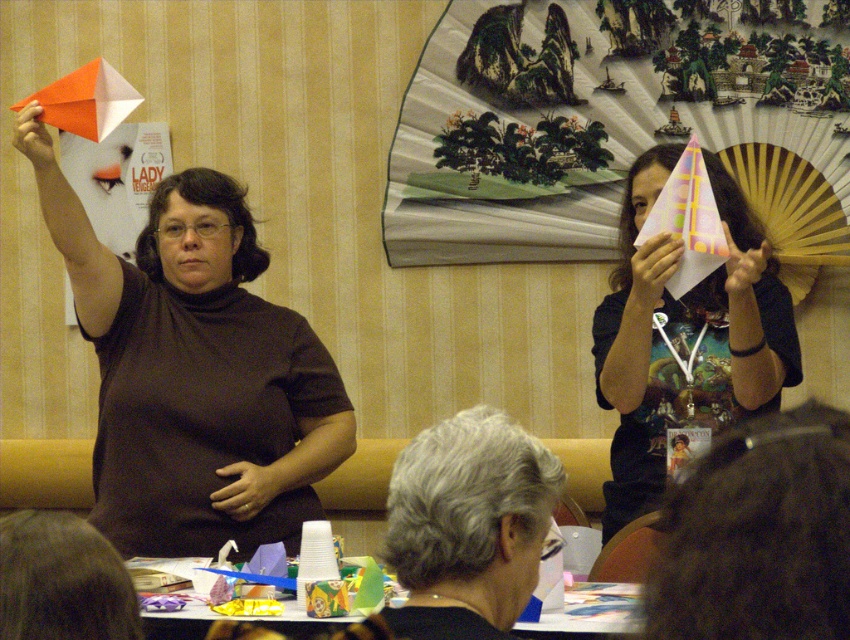
You are an observer in the room. You see the matte pink paper fan at upper right and the gray hair at upper center. Which object is positioned more to the right side of the scene?

The matte pink paper fan at upper right is positioned to the right of gray hair at upper center, so it is more to the right side of the scene.

You are a photographer trying to capture a closeup of the cardboard paper at lower center without including the matte brown shirt at upper left in the frame. Based on their positions, is this possible?

The matte brown shirt at upper left is above the cardboard paper at lower center, so if you position your camera below the shirt and focus downward, you can capture the cardboard paper at lower center without including the shirt.